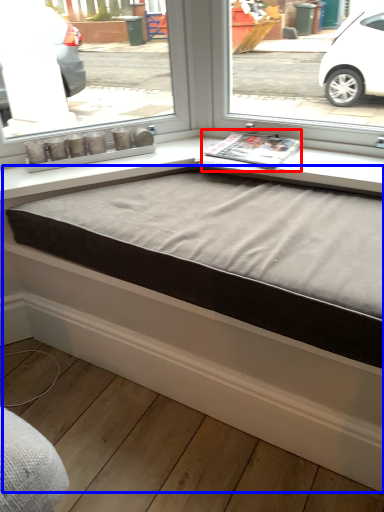
Question: Among these objects, which one is nearest to the camera, magazine (highlighted by a red box) or bed frame (highlighted by a blue box)?

Choices:
 (A) magazine
 (B) bed frame

Answer: (B)